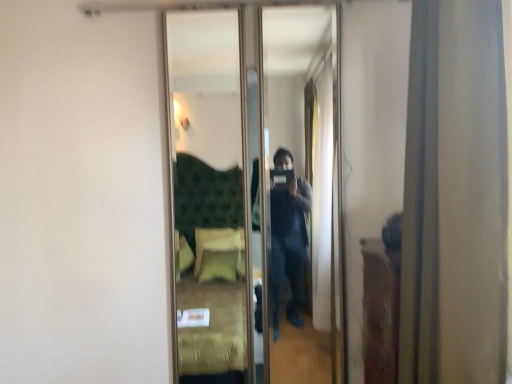
Question: In the image, is matte gold curtain at right positioned in front of or behind clear glass mirror at center?

Choices:
 (A) front
 (B) behind

Answer: (A)

Question: Based on their sizes in the image, would you say matte gold curtain at right is bigger or smaller than clear glass mirror at center?

Choices:
 (A) big
 (B) small

Answer: (A)

Question: Considering the positions of matte gold curtain at right and clear glass mirror at center in the image, is matte gold curtain at right wider or thinner than clear glass mirror at center?

Choices:
 (A) wide
 (B) thin

Answer: (A)

Question: Considering their positions, is clear glass mirror at center located in front of or behind matte gold curtain at right?

Choices:
 (A) front
 (B) behind

Answer: (B)

Question: From a real-world perspective, relative to matte gold curtain at right, is clear glass mirror at center vertically above or below?

Choices:
 (A) below
 (B) above

Answer: (A)

Question: Considering the positions of point (173, 172) and point (410, 349), is point (173, 172) closer or farther from the camera than point (410, 349)?

Choices:
 (A) closer
 (B) farther

Answer: (B)

Question: In the image, is clear glass mirror at center on the left side or the right side of matte gold curtain at right?

Choices:
 (A) left
 (B) right

Answer: (A)